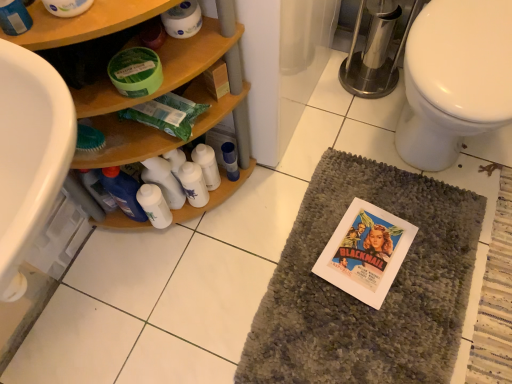
Identify the location of empty space that is in between woodenmaterial/texturebathroom cabinet at left and gray textured bath mat at center. The image size is (512, 384). (231, 254).